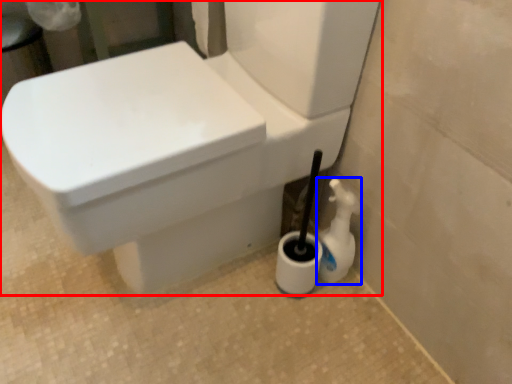
Question: Which object is further to the camera taking this photo, toilet (highlighted by a red box) or cleaning product (highlighted by a blue box)?

Choices:
 (A) toilet
 (B) cleaning product

Answer: (B)